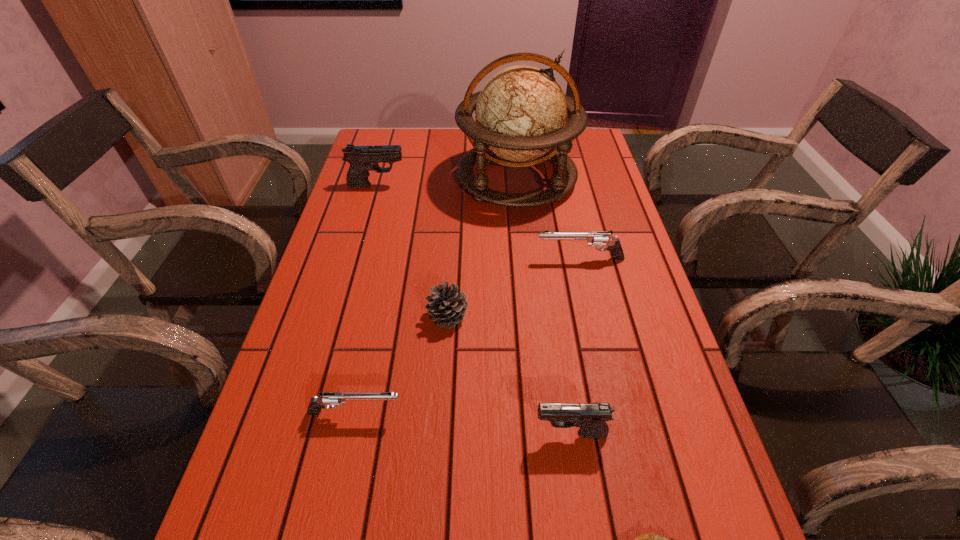
You are a GUI agent. You are given a task and a screenshot of the screen. Output one action in this format:
    pyautogui.click(x=<x>, y=<y>)
    Task: Click on the object that is at the far edge
    This screenshot has height=540, width=960.
    Given the screenshot: What is the action you would take?
    pyautogui.click(x=521, y=112)

You are a GUI agent. You are given a task and a screenshot of the screen. Output one action in this format:
    pyautogui.click(x=<x>, y=<y>)
    Task: Click on the globe at the right edge
    Image resolution: width=960 pixels, height=540 pixels.
    Given the screenshot: What is the action you would take?
    pyautogui.click(x=521, y=112)

Locate an element on the screen. pistol positioned at the right edge is located at coordinates (594, 238).

Image resolution: width=960 pixels, height=540 pixels. I want to click on object located at the far right corner, so click(x=521, y=112).

Where is `vacant area at the far edge of the desktop`? vacant area at the far edge of the desktop is located at coordinates (415, 161).

Image resolution: width=960 pixels, height=540 pixels. I want to click on free location at the left edge, so 289,418.

Identify the location of free space at the right edge. (604, 355).

You are a GUI agent. You are given a task and a screenshot of the screen. Output one action in this format:
    pyautogui.click(x=<x>, y=<y>)
    Task: Click on the vacant space at the far right corner
    The width and height of the screenshot is (960, 540).
    Given the screenshot: What is the action you would take?
    click(588, 134)

Identify the location of vacant point located between the pinecone and the globe. [482, 247].

Where is `free space between the globe and the nearest pistol`? free space between the globe and the nearest pistol is located at coordinates (543, 306).